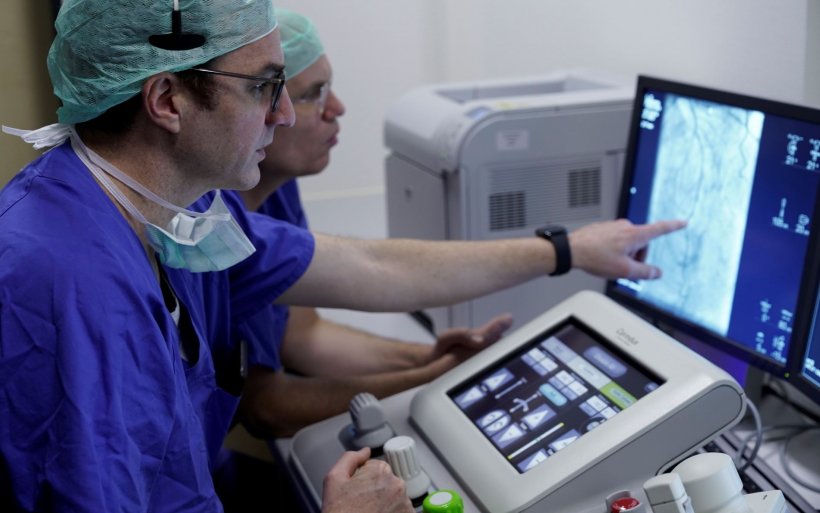
Find the location of a particular element. knobs is located at coordinates (375, 420), (397, 455), (713, 475), (440, 500), (663, 488).